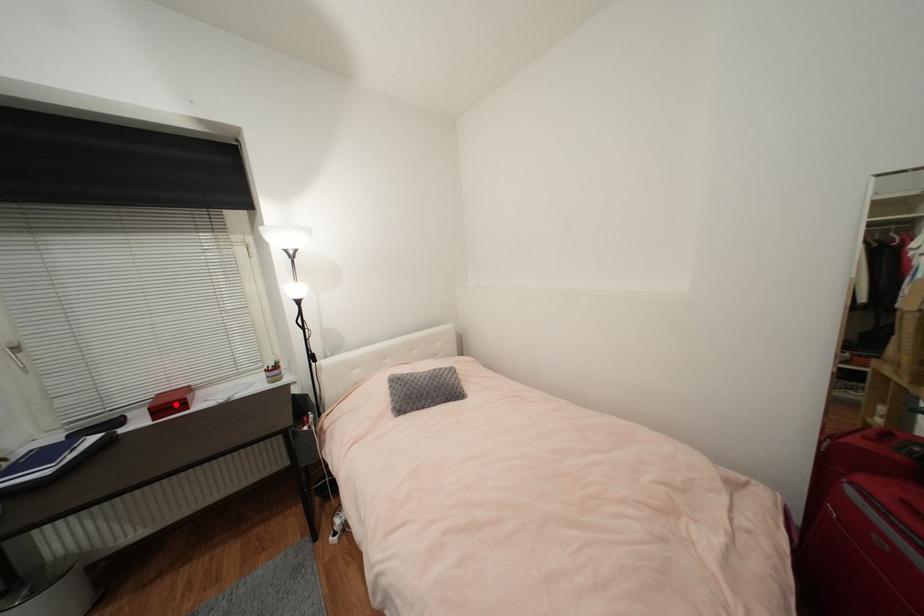
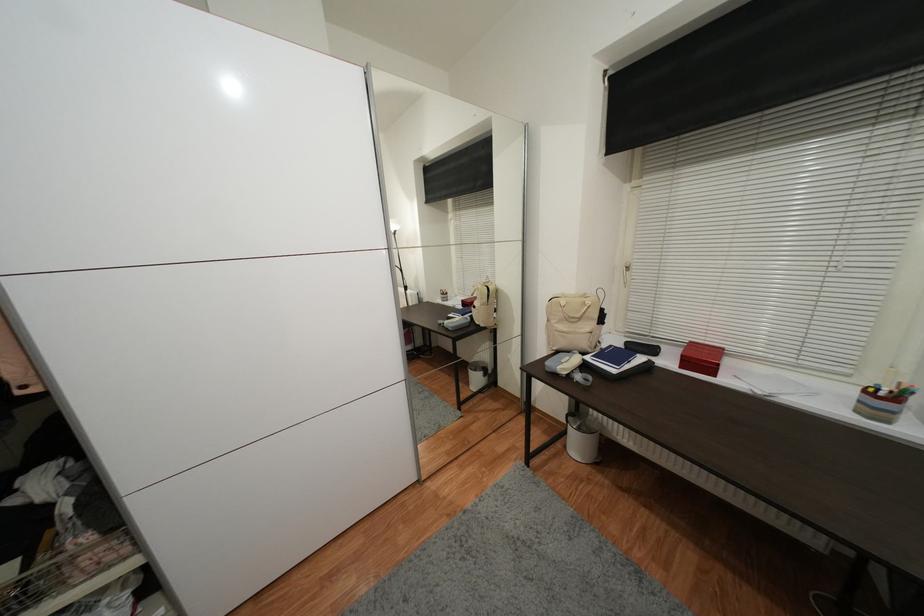
Locate, in the second image, the point that corresponds to the highlighted location in the first image.

(706, 361)